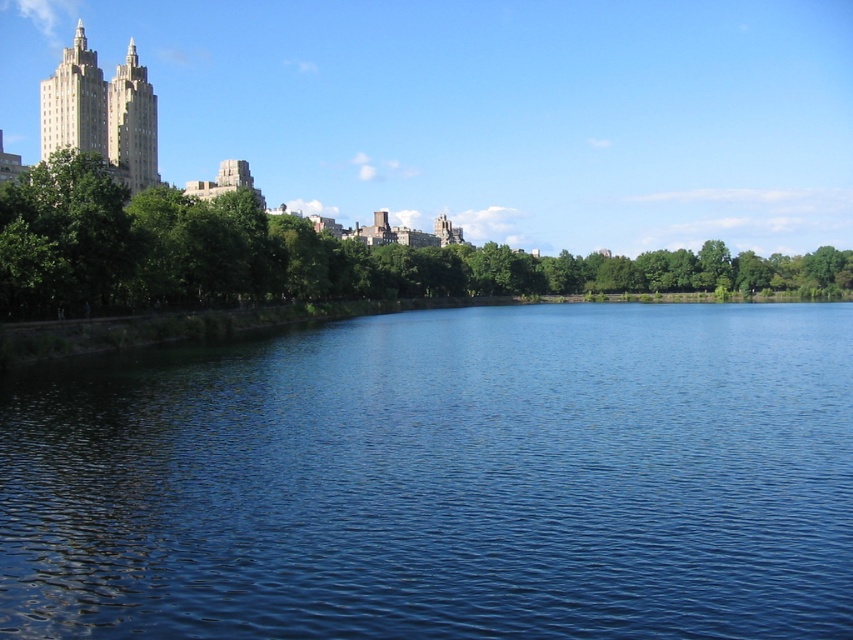
Question: Is green leafy trees at upper left thinner than gold textured building at upper left?

Choices:
 (A) yes
 (B) no

Answer: (B)

Question: Among these objects, which one is farthest from the camera?

Choices:
 (A) gold textured building at upper left
 (B) green leafy trees at upper left

Answer: (A)

Question: Is green leafy trees at upper left behind gold textured building at upper left?

Choices:
 (A) yes
 (B) no

Answer: (B)

Question: Among these points, which one is farthest from the camera?

Choices:
 (A) (47, 150)
 (B) (12, 218)
 (C) (515, 600)

Answer: (A)

Question: Which of these objects is positioned farthest from the green leafy trees at upper left?

Choices:
 (A) blue liquid at center
 (B) gold textured building at upper left

Answer: (A)

Question: Considering the relative positions of green leafy trees at upper left and gold textured building at upper left in the image provided, where is green leafy trees at upper left located with respect to gold textured building at upper left?

Choices:
 (A) right
 (B) left

Answer: (A)